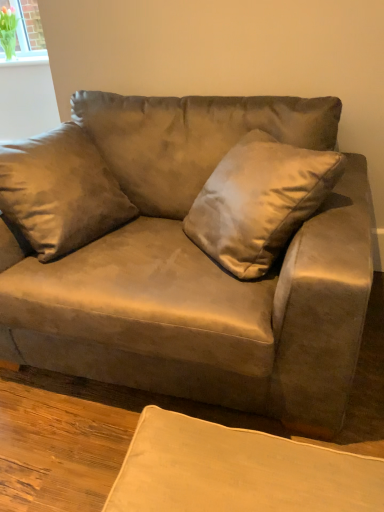
What do you see at coordinates (27, 28) in the screenshot? The image size is (384, 512). I see `clear glass vase at upper left` at bounding box center [27, 28].

Identify the location of suede couch at center. This screenshot has width=384, height=512. (199, 269).

Between satin gold pillow at center and clear glass vase at upper left, which one appears on the left side from the viewer's perspective?

clear glass vase at upper left.

Is satin gold pillow at center not close to clear glass vase at upper left?

Yes, satin gold pillow at center and clear glass vase at upper left are located far from each other.

Is satin gold pillow at center inside or outside of clear glass vase at upper left?

The correct answer is: outside.

Does satin gold pillow at center have a greater height compared to clear glass vase at upper left?

Correct, satin gold pillow at center is much taller as clear glass vase at upper left.

Considering the sizes of objects suede couch at center and clear glass vase at upper left in the image provided, who is wider, suede couch at center or clear glass vase at upper left?

suede couch at center.

Is suede couch at center not inside clear glass vase at upper left?

Yes, suede couch at center is outside of clear glass vase at upper left.

Is point (273, 117) closer or farther from the camera than point (17, 7)?

Clearly, point (273, 117) is closer to the camera than point (17, 7).

Which is more to the left, suede couch at center or clear glass vase at upper left?

clear glass vase at upper left.

Is point (22, 4) positioned behind point (305, 201)?

Yes.

Can we say clear glass vase at upper left lies outside satin gold pillow at center?

Yes.

Are clear glass vase at upper left and satin gold pillow at center beside each other?

No, clear glass vase at upper left is not next to satin gold pillow at center.

From the image's perspective, is clear glass vase at upper left beneath satin gold pillow at center?

Actually, clear glass vase at upper left appears above satin gold pillow at center in the image.

Looking at their sizes, would you say clear glass vase at upper left is wider or thinner than suede couch at center?

Considering their sizes, clear glass vase at upper left looks slimmer than suede couch at center.

Would you say clear glass vase at upper left is inside or outside suede couch at center?

clear glass vase at upper left lies outside suede couch at center.

Is clear glass vase at upper left facing towards suede couch at center?

No, clear glass vase at upper left does not turn towards suede couch at center.

Is clear glass vase at upper left behind suede couch at center?

Yes, clear glass vase at upper left is behind suede couch at center.

Considering the relative positions of satin gold pillow at center and suede couch at center in the image provided, is satin gold pillow at center to the left of suede couch at center from the viewer's perspective?

Incorrect, satin gold pillow at center is not on the left side of suede couch at center.

Is satin gold pillow at center not close to suede couch at center?

Actually, satin gold pillow at center and suede couch at center are a little close together.

Which point is more distant from viewer, (206,201) or (219,146)?

The point (219,146) is farther from the camera.

Is suede couch at center surrounded by satin gold pillow at center?

No, suede couch at center is not surrounded by satin gold pillow at center.

Where is `throw pillow above the suede couch at center (from the image's perspective)`? throw pillow above the suede couch at center (from the image's perspective) is located at coordinates (259, 201).

Choose the correct answer: Is suede couch at center inside satin gold pillow at center or outside it?

suede couch at center is not enclosed by satin gold pillow at center.

Between point (69, 275) and point (215, 178), which one is positioned behind?

The point (215, 178) is more distant.

Considering the positions of objects suede couch at center and satin gold pillow at center in the image provided, who is in front, suede couch at center or satin gold pillow at center?

Positioned in front is suede couch at center.

Locate an element on the screen. This screenshot has height=512, width=384. throw pillow to the right of clear glass vase at upper left is located at coordinates (259, 201).

This screenshot has width=384, height=512. What are the coordinates of `studio couch below the clear glass vase at upper left (from a real-world perspective)` in the screenshot? It's located at (199, 269).

Which object lies nearer to the anchor point clear glass vase at upper left, satin gold pillow at center or suede couch at center?

Among the two, suede couch at center is located nearer to clear glass vase at upper left.

Looking at the image, which one is located further to clear glass vase at upper left, suede couch at center or satin gold pillow at center?

satin gold pillow at center is further to clear glass vase at upper left.

In the scene shown: Estimate the real-world distances between objects in this image. Which object is further from satin gold pillow at center, clear glass vase at upper left or suede couch at center?

clear glass vase at upper left is positioned further to the anchor satin gold pillow at center.

From the image, which object appears to be nearer to satin gold pillow at center, suede couch at center or clear glass vase at upper left?

The object closer to satin gold pillow at center is suede couch at center.

Considering their positions, is clear glass vase at upper left positioned further to suede couch at center than satin gold pillow at center?

Based on the image, clear glass vase at upper left appears to be further to suede couch at center.

When comparing their distances from suede couch at center, does satin gold pillow at center or clear glass vase at upper left seem further?

clear glass vase at upper left.

At what (x,y) coordinates should I click in order to perform the action: click on throw pillow located between suede couch at center and clear glass vase at upper left in the depth direction. Please return your answer as a coordinate pair (x, y). This screenshot has height=512, width=384. Looking at the image, I should click on (259, 201).